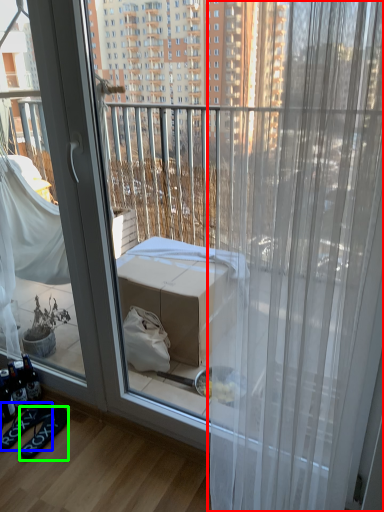
Question: Based on their relative distances, which object is nearer to curtain (highlighted by a red box)? Choose from footwear (highlighted by a blue box) and footwear (highlighted by a green box).

Choices:
 (A) footwear
 (B) footwear

Answer: (B)